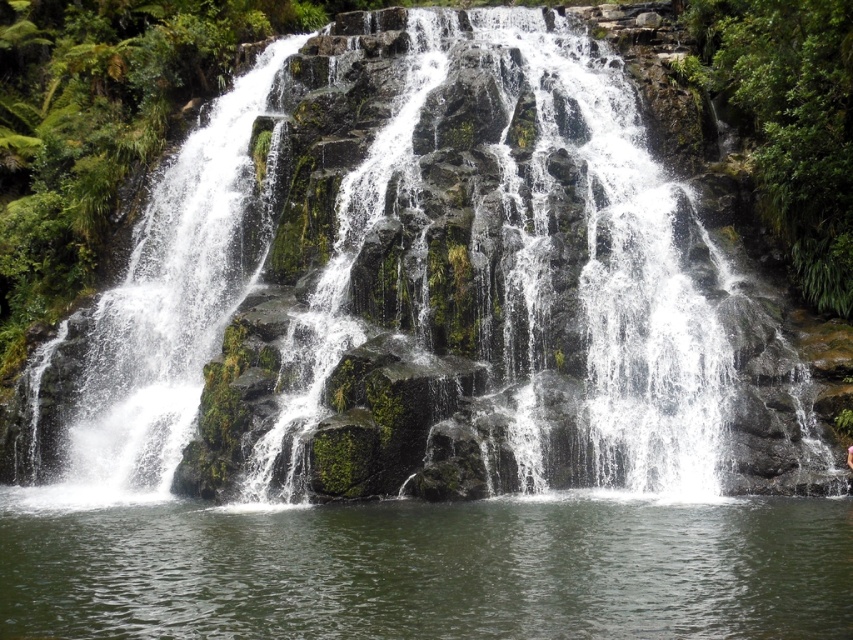
Question: Can you confirm if clear water at bottom is thinner than pink fabric at center?

Choices:
 (A) yes
 (B) no

Answer: (B)

Question: Among these points, which one is nearest to the camera?

Choices:
 (A) (850, 445)
 (B) (109, 522)

Answer: (B)

Question: Can you confirm if clear water at bottom is wider than pink fabric at center?

Choices:
 (A) no
 (B) yes

Answer: (B)

Question: Which point is closer to the camera?

Choices:
 (A) (846, 451)
 (B) (555, 548)

Answer: (B)

Question: Is clear water at bottom closer to camera compared to pink fabric at center?

Choices:
 (A) yes
 (B) no

Answer: (A)

Question: Which point appears closest to the camera in this image?

Choices:
 (A) (848, 448)
 (B) (521, 605)

Answer: (B)